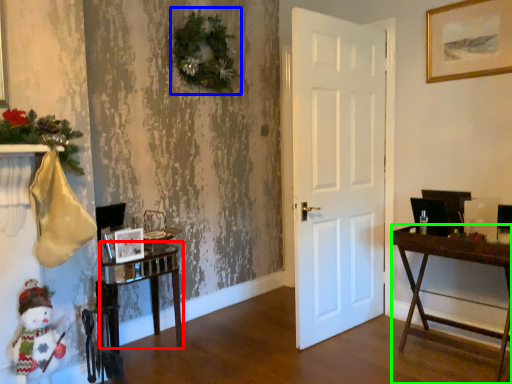
Question: Which object is the farthest from table (highlighted by a red box)? Choose among these: christmas decoration (highlighted by a blue box) or desk (highlighted by a green box).

Choices:
 (A) christmas decoration
 (B) desk

Answer: (B)